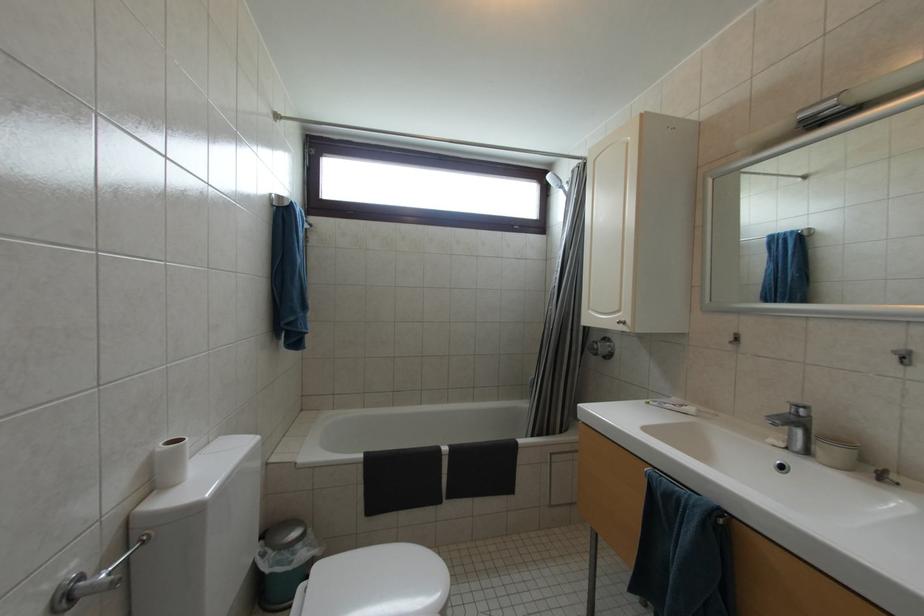
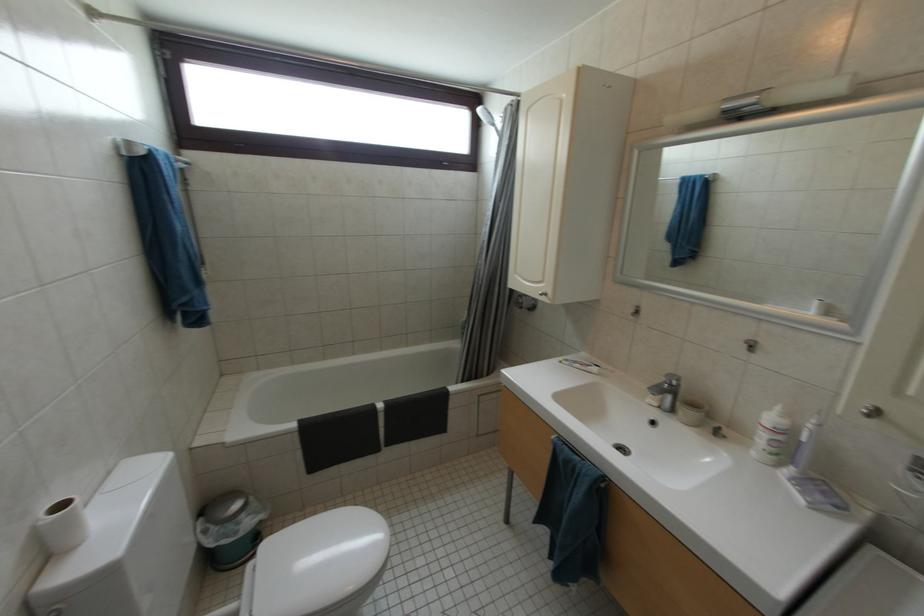
In a continuous first-person perspective shot, in which direction is the camera moving?

The cameraman walked toward right, forward.